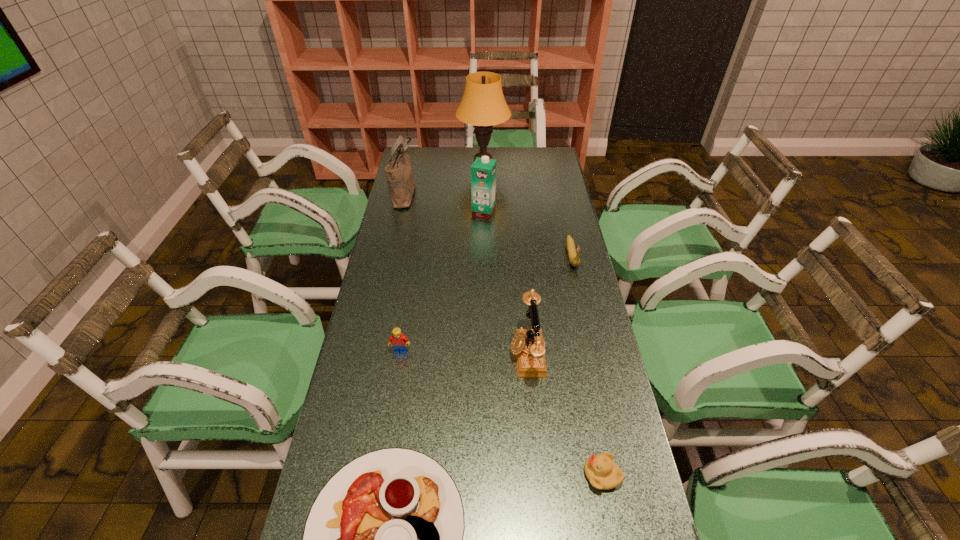
Identify the location of shoulder bag present at the left edge. (399, 175).

Find the location of `Lego located in the left edge section of the desktop`. Lego located in the left edge section of the desktop is located at coordinates (399, 341).

Where is `banana at the right edge`? The height and width of the screenshot is (540, 960). banana at the right edge is located at coordinates (574, 260).

Locate an element on the screen. This screenshot has width=960, height=540. duckling that is at the right edge is located at coordinates (602, 472).

In order to click on vacant region at the left edge in this screenshot , I will do `click(413, 322)`.

In the image, there is a desktop. At what (x,y) coordinates should I click in order to perform the action: click on vacant space at the right edge. Please return your answer as a coordinate pair (x, y). This screenshot has width=960, height=540. Looking at the image, I should click on (599, 412).

Image resolution: width=960 pixels, height=540 pixels. What are the coordinates of `unoccupied position between the telephone and the lampshade` in the screenshot? It's located at (505, 257).

Locate an element on the screen. The width and height of the screenshot is (960, 540). vacant space that is in between the Lego and the fourth tallest object is located at coordinates (464, 352).

Find the location of a particular element. This screenshot has width=960, height=540. vacant space in between the lampshade and the seventh tallest object is located at coordinates (542, 318).

I want to click on vacant space that is in between the shoulder bag and the Lego, so click(402, 272).